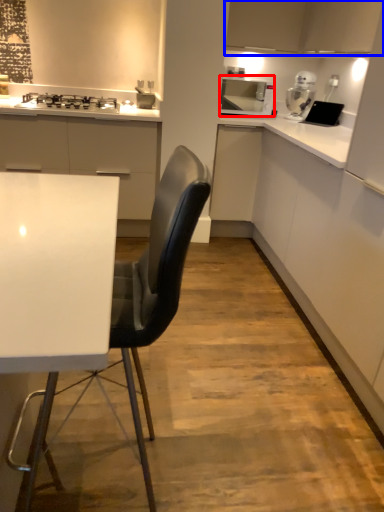
Question: Among these objects, which one is farthest to the camera, home appliance (highlighted by a red box) or cabinetry (highlighted by a blue box)?

Choices:
 (A) home appliance
 (B) cabinetry

Answer: (A)